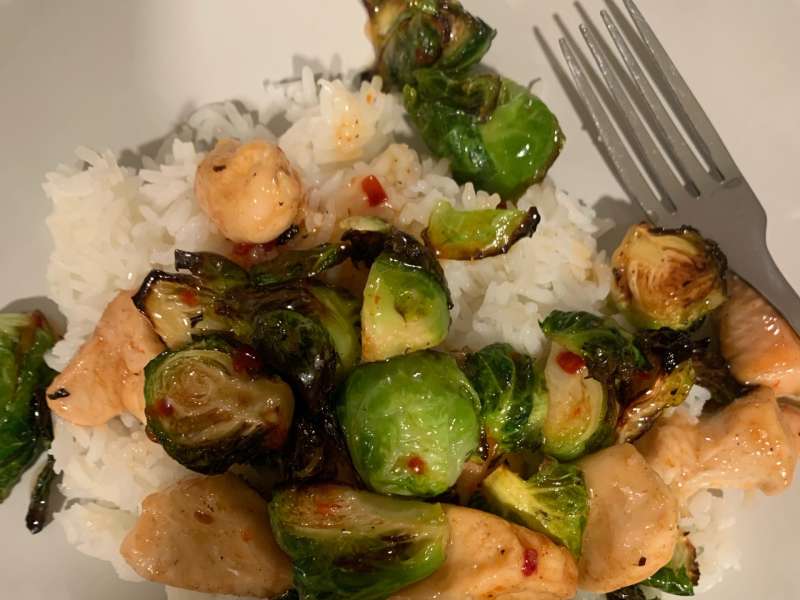
The width and height of the screenshot is (800, 600). Find the location of `fork`. fork is located at coordinates (614, 61), (740, 235), (776, 295).